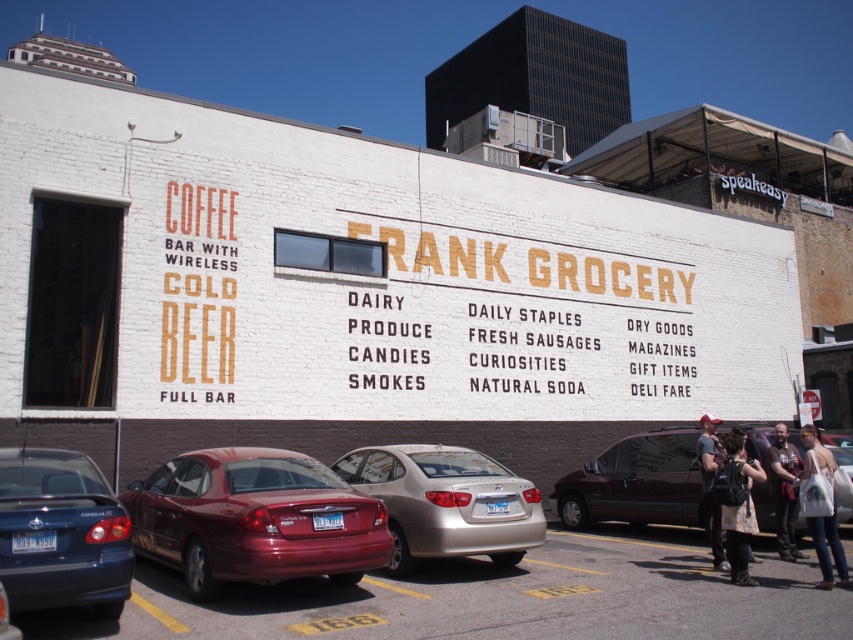
What is the spatial relationship between the shiny red sedan at center and the matte blue sedan at lower left?

The shiny red sedan at center is to the right of the matte blue sedan at lower left.

You are a customer arriving at the building and need to park your car. You see a matte blue sedan at lower left and a maroon matte van at lower right. Which parking spot is closer to the entrance of the building?

The matte blue sedan at lower left is closer to the entrance of the building because it is in front of the maroon matte van at lower right, which is further away.

What is the spatial relationship between the matte blue sedan at lower left and the white fabric bag at lower right in terms of height?

The matte blue sedan at lower left is much taller than the white fabric bag at lower right.